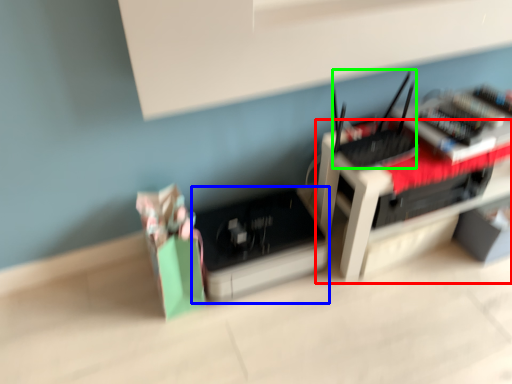
Question: Considering the real-world distances, which object is closest to furniture (highlighted by a red box)? register (highlighted by a blue box) or register (highlighted by a green box).

Choices:
 (A) register
 (B) register

Answer: (B)